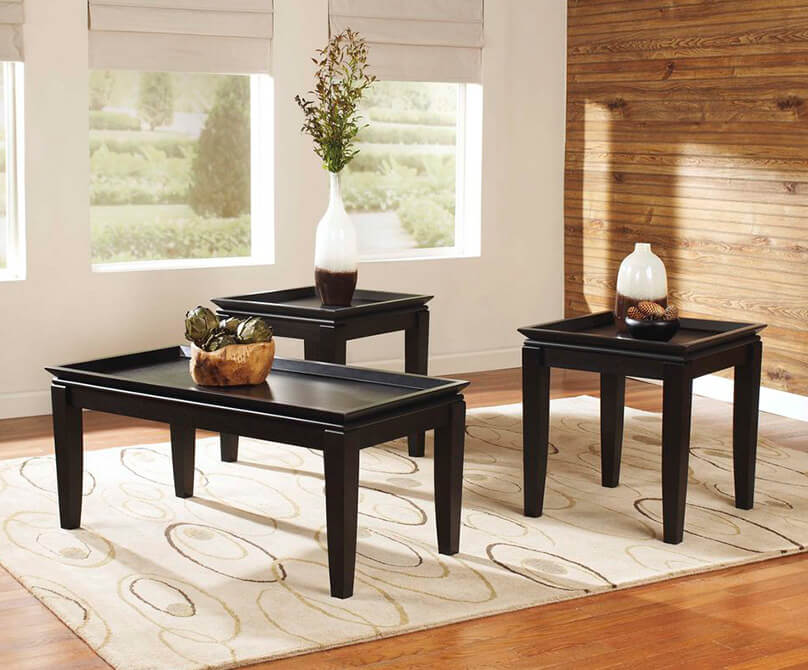
Where is `blinds`? blinds is located at coordinates (14, 49), (111, 50), (443, 29).